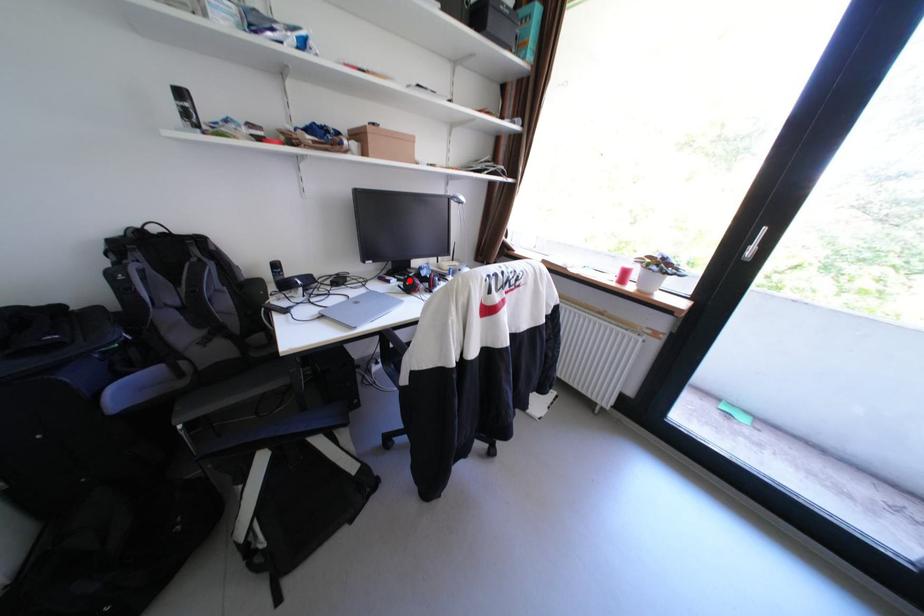
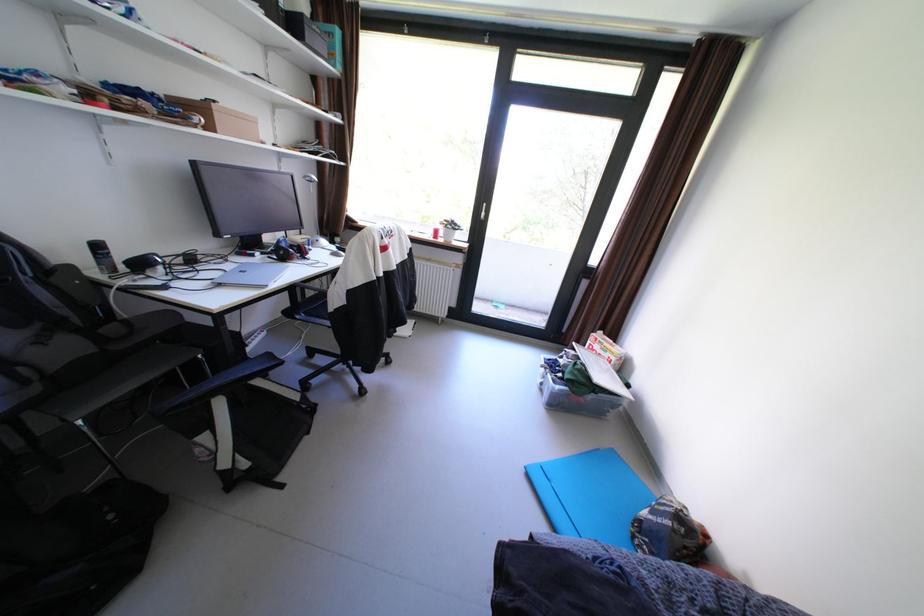
Find the pixel in the second image that matches the highlighted location in the first image.

(274, 254)